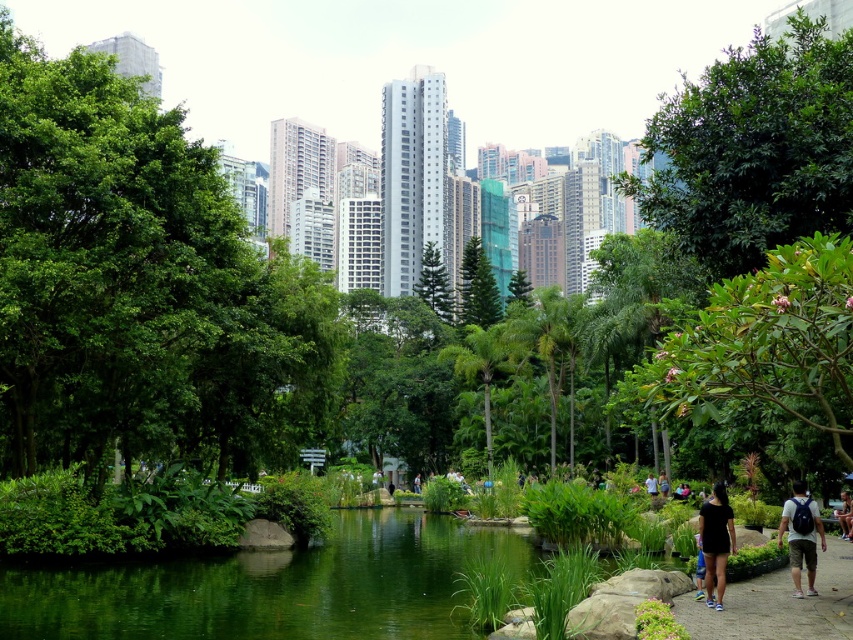
You are a gardener planning to plant a new tree in the urban park. The tree you want to plant has a mature width of 3 meters. The smooth concrete path at lower right is 2 meters wide. If you plant the tree where the green leafy tree at center is currently located, will the new tree fit without encroaching on the path?

The green leafy tree at center has a width larger than the smooth concrete path at lower right. Since the path is 2 meters wide and the new tree requires 3 meters, planting it in the same location would cause the tree to encroach on the path as its width exceeds the path width.

You are a photographer setting up a tripod in the park. You notice the black fabric at lower right and the light brown leather jacket at lower right. Which object would block your view of the other if placed between you and the objects?

The black fabric at lower right is larger in size than the light brown leather jacket at lower right, so if placed between you and the objects, the black fabric at lower right would block the view of the light brown leather jacket at lower right.

You are a photographer wanting to capture both the black fabric at lower right and the black cotton shirt at center in the same frame. Which object should you focus on first if you want to ensure both are in the frame without moving the camera?

You should focus on the black cotton shirt at center first because the black fabric at lower right is wider than the black cotton shirt at center, so centering the shirt allows the wider fabric to still be within the frame.